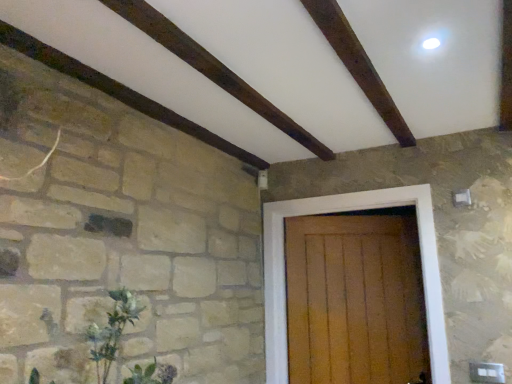
Locate an element on the screen. green leafy plant at lower left is located at coordinates (112, 331).

What do you see at coordinates (112, 331) in the screenshot? Image resolution: width=512 pixels, height=384 pixels. I see `green leafy plant at lower left` at bounding box center [112, 331].

Describe the element at coordinates (347, 211) in the screenshot. I see `wooden door at center` at that location.

The width and height of the screenshot is (512, 384). Identify the location of wooden door at center. (347, 211).

Where is `green leafy plant at lower left`? The height and width of the screenshot is (384, 512). green leafy plant at lower left is located at coordinates (112, 331).

In the image, is wooden door at center on the left side or the right side of green leafy plant at lower left?

wooden door at center is to the right of green leafy plant at lower left.

Which object is further away from the camera, wooden door at center or green leafy plant at lower left?

Positioned behind is wooden door at center.

Considering the positions of point (434, 258) and point (157, 373), is point (434, 258) closer or farther from the camera than point (157, 373)?

Point (434, 258).

From the image's perspective, is wooden door at center over green leafy plant at lower left?

No, from the image's perspective, wooden door at center is not on top of green leafy plant at lower left.

Looking at this image, from a real-world perspective, is wooden door at center physically located above or below green leafy plant at lower left?

wooden door at center is above green leafy plant at lower left.

Which object is thinner, wooden door at center or green leafy plant at lower left?

wooden door at center.

In terms of height, does wooden door at center look taller or shorter compared to green leafy plant at lower left?

wooden door at center is taller than green leafy plant at lower left.

Which of these two, wooden door at center or green leafy plant at lower left, is bigger?

wooden door at center.

Choose the correct answer: Is wooden door at center inside green leafy plant at lower left or outside it?

wooden door at center exists outside the volume of green leafy plant at lower left.

Based on the photo, are wooden door at center and green leafy plant at lower left beside each other?

Answer: wooden door at center and green leafy plant at lower left are not in contact.

Does wooden door at center turn towards green leafy plant at lower left?

Yes, wooden door at center faces towards green leafy plant at lower left.

This screenshot has width=512, height=384. I want to click on plant in front of the wooden door at center, so click(112, 331).

Which is more to the right, green leafy plant at lower left or wooden door at center?

From the viewer's perspective, wooden door at center appears more on the right side.

Relative to wooden door at center, is green leafy plant at lower left in front or behind?

green leafy plant at lower left is in front of wooden door at center.

Which is less distant, (115, 352) or (344, 207)?

Point (115, 352).

From the image's perspective, which is below, green leafy plant at lower left or wooden door at center?

wooden door at center appears lower in the image.

From a real-world perspective, is green leafy plant at lower left located beneath wooden door at center?

Indeed, from a real-world perspective, green leafy plant at lower left is positioned beneath wooden door at center.

Is green leafy plant at lower left wider or thinner than wooden door at center?

Considering their sizes, green leafy plant at lower left looks broader than wooden door at center.

Can you confirm if green leafy plant at lower left is taller than wooden door at center?

No.

Considering the sizes of objects green leafy plant at lower left and wooden door at center in the image provided, who is bigger, green leafy plant at lower left or wooden door at center?

wooden door at center.

Is green leafy plant at lower left not inside wooden door at center?

Yes.

Is green leafy plant at lower left next to wooden door at center?

They are not placed beside each other.

Is green leafy plant at lower left oriented away from wooden door at center?

No.

How much distance is there between green leafy plant at lower left and wooden door at center?

A distance of 3.75 feet exists between green leafy plant at lower left and wooden door at center.

Find the location of a particular element. door to the right of green leafy plant at lower left is located at coordinates (347, 211).

In order to click on door located on the right of green leafy plant at lower left in this screenshot , I will do `click(347, 211)`.

Where is `plant beneath the wooden door at center (from a real-world perspective)`? plant beneath the wooden door at center (from a real-world perspective) is located at coordinates pyautogui.click(x=112, y=331).